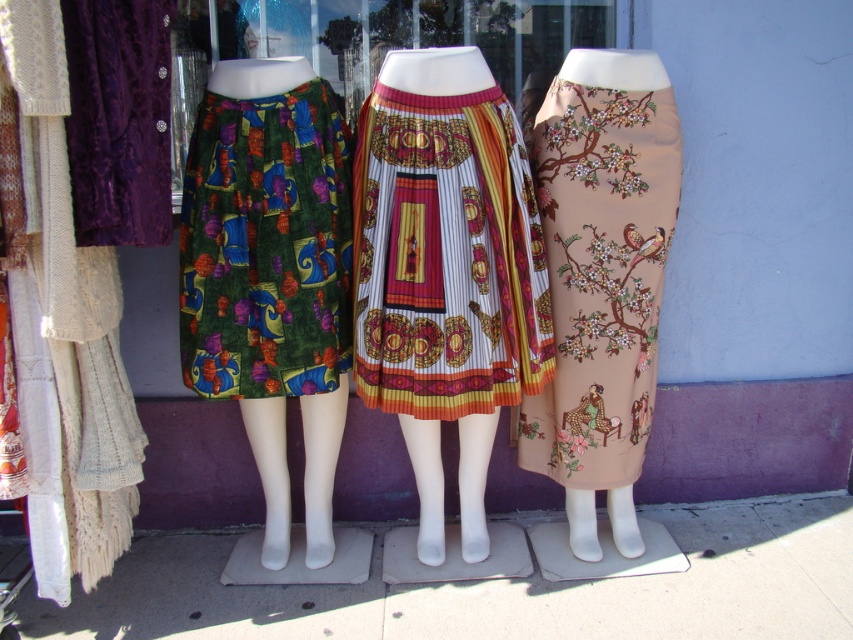
You are standing in front of the mannequins and want to place a small decorative item between the printed cotton skirt at center and the other skirt. Is there enough space to fit it?

The distance between the printed cotton skirt at center and the other skirt is 4.72 feet, so there is sufficient space to place a small decorative item between them.

You are a customer looking at the mannequins in the store window. You want to know which skirt is visible on top between the printed cotton skirt at center and the beige floral skirt at center. Which one is on top?

The printed cotton skirt at center is positioned under the beige floral skirt at center, so the beige floral skirt at center is visible on top.